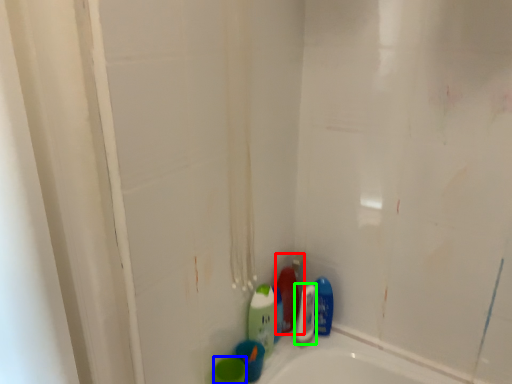
Question: Which object is the farthest from cleaning product (highlighted by a red box)? Choose among these: mouthwash (highlighted by a blue box) or cleaning product (highlighted by a green box).

Choices:
 (A) mouthwash
 (B) cleaning product

Answer: (A)